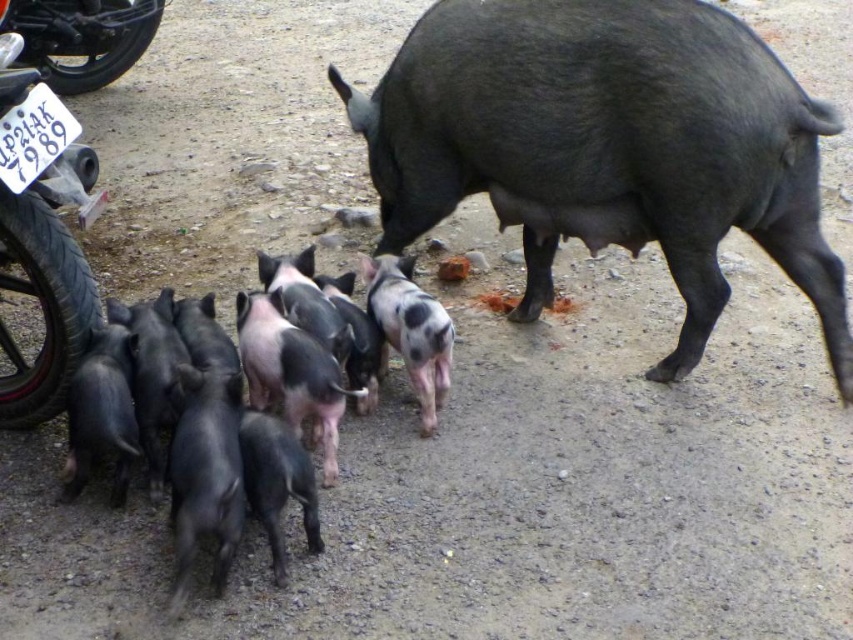
This screenshot has width=853, height=640. I want to click on black rubber tire at lower left, so click(x=82, y=36).

Can you confirm if black rubber tire at lower left is positioned to the right of speckled fur piglet at center?

Incorrect, black rubber tire at lower left is not on the right side of speckled fur piglet at center.

Between point (49, 76) and point (370, 282), which one is positioned in front?

Point (370, 282) is more forward.

The image size is (853, 640). What are the coordinates of `black rubber tire at lower left` in the screenshot? It's located at (82, 36).

Does shiny black piglet at center have a larger size compared to speckled fur piglet at center?

Correct, shiny black piglet at center is larger in size than speckled fur piglet at center.

Does shiny black piglet at center appear on the left side of speckled fur piglet at center?

Incorrect, shiny black piglet at center is not on the left side of speckled fur piglet at center.

Between point (694, 102) and point (451, 328), which one is positioned in front?

Point (694, 102) is more forward.

Where is `shiny black piglet at center`? The width and height of the screenshot is (853, 640). shiny black piglet at center is located at coordinates (607, 145).

Locate an element on the screen. black glossy piglets at center is located at coordinates (x=341, y=339).

Is point (439, 316) less distant than point (396, 308)?

Yes.

Find the location of a particular element. Image resolution: width=853 pixels, height=640 pixels. black glossy piglets at center is located at coordinates (341, 339).